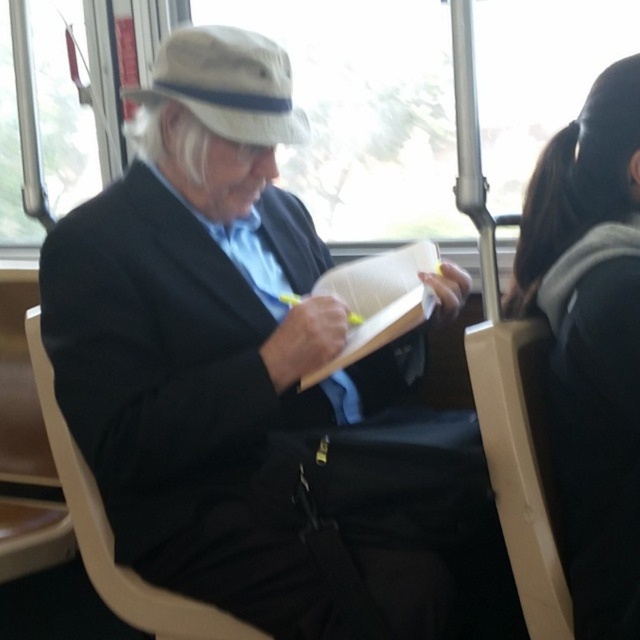
Question: Is matte black book at center positioned in front of beige plastic chair at left?

Choices:
 (A) yes
 (B) no

Answer: (A)

Question: Which object is positioned farthest from the dark gray hair at upper right?

Choices:
 (A) hardcover book at center
 (B) beige plastic chair at left
 (C) beige plastic chair at right
 (D) matte black book at center

Answer: (B)

Question: Which point is closer to the camera taking this photo?

Choices:
 (A) (77, 512)
 (B) (403, 317)
 (C) (554, 516)
 (D) (291, 445)

Answer: (C)

Question: Is matte black book at center to the left of beige plastic chair at right from the viewer's perspective?

Choices:
 (A) yes
 (B) no

Answer: (A)

Question: Can you confirm if matte black book at center is wider than beige plastic chair at right?

Choices:
 (A) no
 (B) yes

Answer: (B)

Question: Among these points, which one is farthest from the camera?

Choices:
 (A) (548, 580)
 (B) (584, 161)
 (C) (380, 304)
 (D) (97, 248)

Answer: (C)